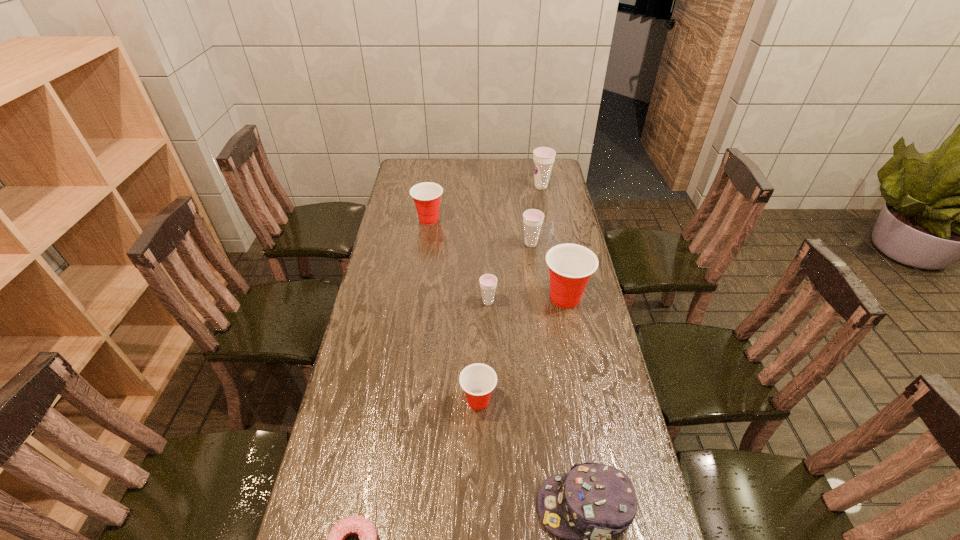
Find the location of `object at the far right corner`. object at the far right corner is located at coordinates (543, 157).

The height and width of the screenshot is (540, 960). In the image, there is a desktop. Identify the location of vacant space at the left edge. (348, 394).

I want to click on free point at the right edge, so click(584, 326).

The image size is (960, 540). Find the location of `vacant space that is in between the biggest red cup and the second smallest red cup`. vacant space that is in between the biggest red cup and the second smallest red cup is located at coordinates (497, 259).

The width and height of the screenshot is (960, 540). In order to click on vacant space that's between the nearest purple cup and the rightmost red cup in this screenshot , I will do `click(526, 300)`.

This screenshot has height=540, width=960. In order to click on free spot between the leftmost cup and the nearest purple cup in this screenshot , I will do `click(459, 261)`.

You are a GUI agent. You are given a task and a screenshot of the screen. Output one action in this format:
    pyautogui.click(x=<x>, y=<y>)
    Task: Click on the vacant space that is in between the rightmost red cup and the farthest object
    Image resolution: width=960 pixels, height=540 pixels.
    Given the screenshot: What is the action you would take?
    pyautogui.click(x=553, y=242)

The height and width of the screenshot is (540, 960). Identify the location of object that is the sixth closest to the second farthest red cup. (543, 157).

Identify which object is the fourth closest to the rightmost red cup. Please provide its 2D coordinates. Your answer should be formatted as a tuple, i.e. [(x, y)], where the tuple contains the x and y coordinates of a point satisfying the conditions above.

[(426, 195)]

Point out which cup is positioned as the third nearest to the rightmost red cup. Please provide its 2D coordinates. Your answer should be formatted as a tuple, i.e. [(x, y)], where the tuple contains the x and y coordinates of a point satisfying the conditions above.

[(478, 380)]